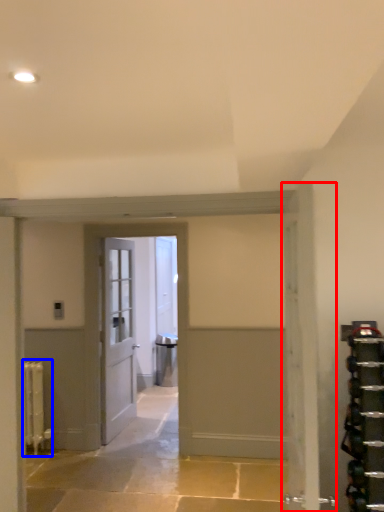
Question: Which object is further to the camera taking this photo, door (highlighted by a red box) or radiator (highlighted by a blue box)?

Choices:
 (A) door
 (B) radiator

Answer: (B)